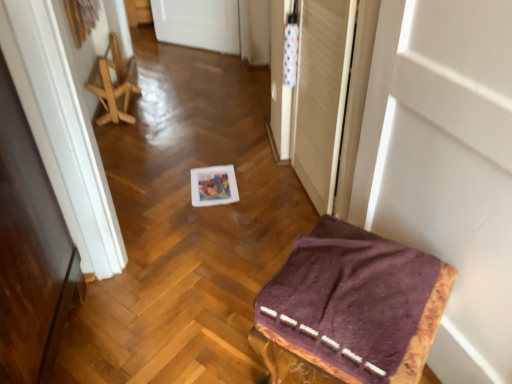
You are a GUI agent. You are given a task and a screenshot of the screen. Output one action in this format:
    pyautogui.click(x=<x>, y=<y>)
    Task: Click on the free space to the back side of transparent plastic screen door at upper right
    
    Given the screenshot: What is the action you would take?
    pyautogui.click(x=263, y=160)